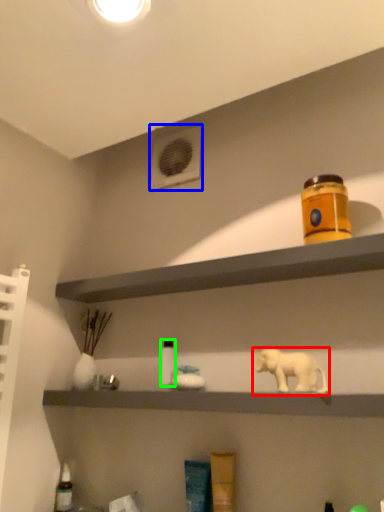
Question: Which object is positioned closest to elephant (highlighted by a red box)? Select from air conditioning (highlighted by a blue box) and bottle (highlighted by a green box).

Choices:
 (A) air conditioning
 (B) bottle

Answer: (B)